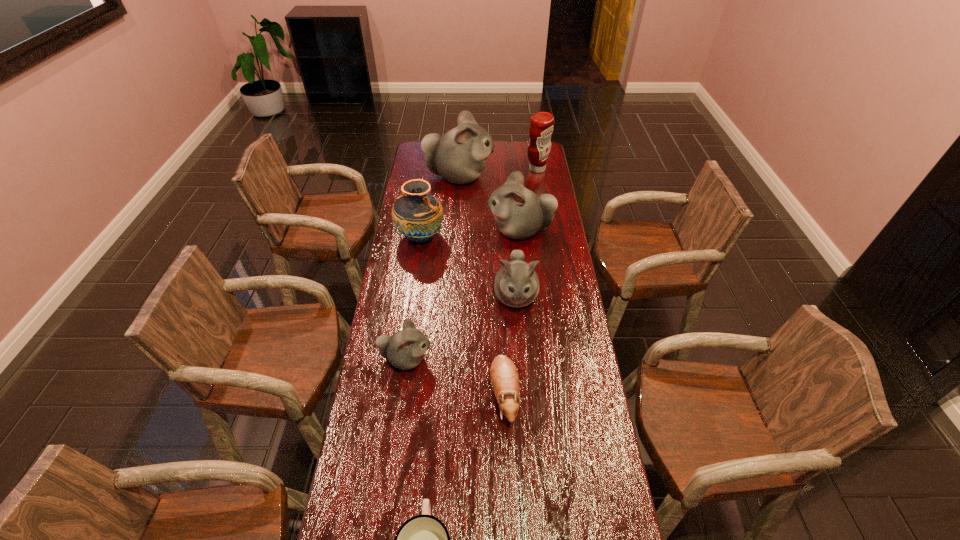
Find the location of a particular element. This screenshot has width=960, height=540. hamster that is at the far edge is located at coordinates (459, 156).

Where is `condiment that is positioned at the far edge`? Image resolution: width=960 pixels, height=540 pixels. condiment that is positioned at the far edge is located at coordinates (x=541, y=128).

I want to click on pottery that is at the left edge, so click(x=418, y=216).

Where is `condiment present at the right edge`? condiment present at the right edge is located at coordinates (541, 128).

This screenshot has width=960, height=540. In order to click on object that is at the far left corner in this screenshot , I will do `click(459, 156)`.

At what (x,y) coordinates should I click in order to perform the action: click on object at the far right corner. Please return your answer as a coordinate pair (x, y). The height and width of the screenshot is (540, 960). Looking at the image, I should click on (541, 128).

The height and width of the screenshot is (540, 960). Find the location of `vacant space at the left edge of the desktop`. vacant space at the left edge of the desktop is located at coordinates (369, 456).

I want to click on blank space at the right edge of the desktop, so click(582, 496).

Image resolution: width=960 pixels, height=540 pixels. Find the location of `free space that is in between the fourth tallest hamster and the second smallest white hamster`. free space that is in between the fourth tallest hamster and the second smallest white hamster is located at coordinates (461, 327).

Where is `free space between the shortest hamster and the biggest white hamster`? free space between the shortest hamster and the biggest white hamster is located at coordinates (481, 285).